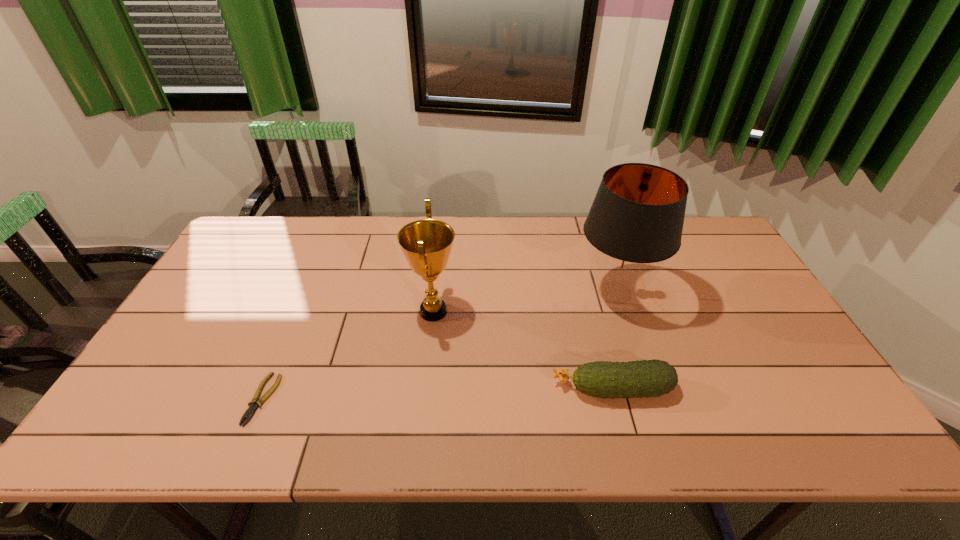
You are a GUI agent. You are given a task and a screenshot of the screen. Output one action in this format:
    pyautogui.click(x=<x>, y=<y>)
    Task: Click on the lampshade
    This screenshot has height=540, width=960.
    Given the screenshot: What is the action you would take?
    pyautogui.click(x=636, y=220)

Locate an element on the screen. The height and width of the screenshot is (540, 960). the second tallest object is located at coordinates pyautogui.click(x=426, y=244).

Find the location of a particular element. award is located at coordinates [x=426, y=244].

This screenshot has height=540, width=960. I want to click on the second shortest object, so point(648,378).

You are a GUI agent. You are given a task and a screenshot of the screen. Output one action in this format:
    pyautogui.click(x=<x>, y=<y>)
    Task: Click on the shortest object
    Image resolution: width=960 pixels, height=540 pixels.
    Given the screenshot: What is the action you would take?
    pyautogui.click(x=250, y=411)

Locate an element on the screen. The width and height of the screenshot is (960, 540). the leftmost object is located at coordinates (250, 411).

You are a GUI agent. You are given a task and a screenshot of the screen. Output one action in this format:
    pyautogui.click(x=<x>, y=<y>)
    Task: Click on the vacant space located on the right of the lampshade
    This screenshot has height=540, width=960.
    Given the screenshot: What is the action you would take?
    pyautogui.click(x=694, y=293)

The width and height of the screenshot is (960, 540). Find the location of `free space located 0.310m on the front view with handles of the third object from right to left`. free space located 0.310m on the front view with handles of the third object from right to left is located at coordinates (566, 312).

Identify the location of free region located at the blossom end of the cucumber. This screenshot has height=540, width=960. tap(494, 389).

At what (x,y) coordinates should I click in order to perform the action: click on free region located 0.330m at the blossom end of the cucumber. Please return your answer as a coordinate pair (x, y). Looking at the image, I should click on (417, 389).